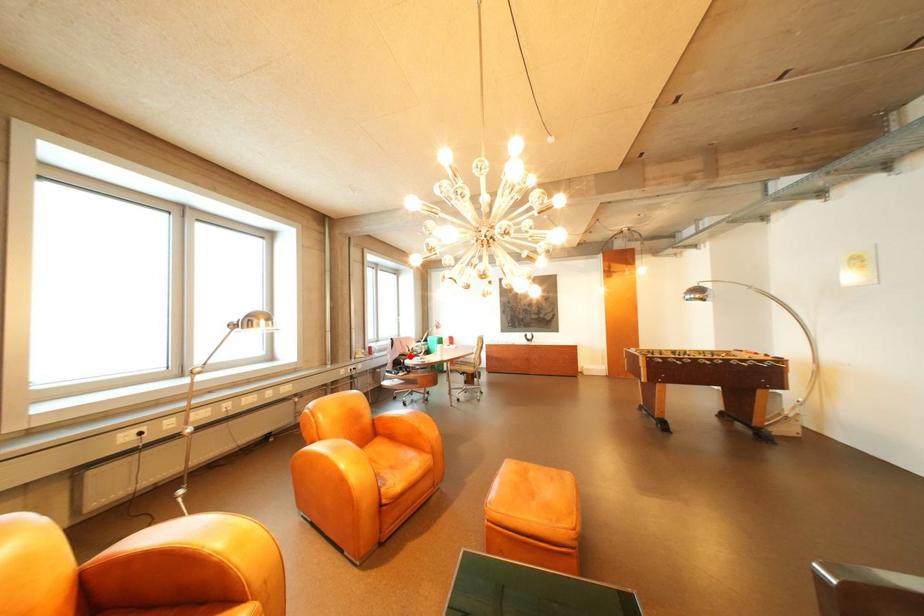
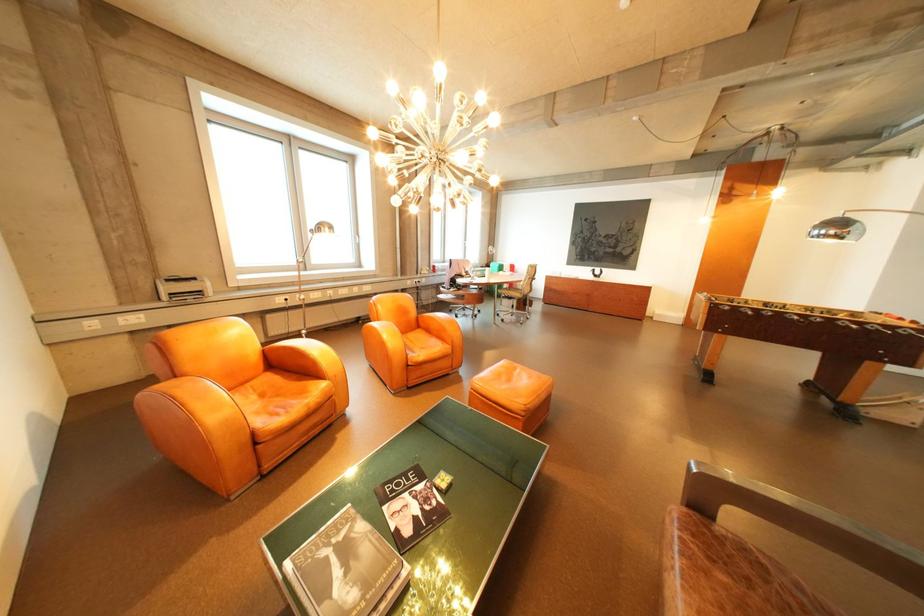
Question: I am providing you with two images of the same scene from different viewpoints. Image1 has a red point marked. In image2, the corresponding 3D location appears at what relative position? Reply with the corresponding letter.

Choices:
 (A) Closer
 (B) Farther

Answer: (A)